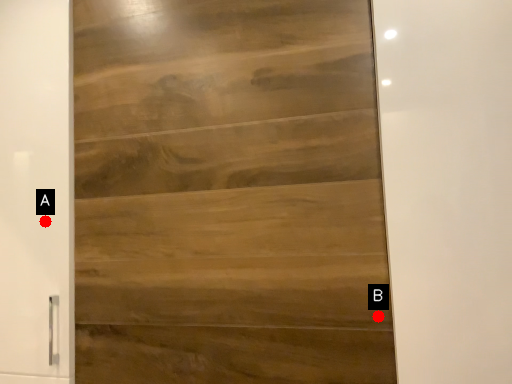
Question: Two points are circled on the image, labeled by A and B beside each circle. Which point appears closest to the camera in this image?

Choices:
 (A) A is closer
 (B) B is closer

Answer: (B)